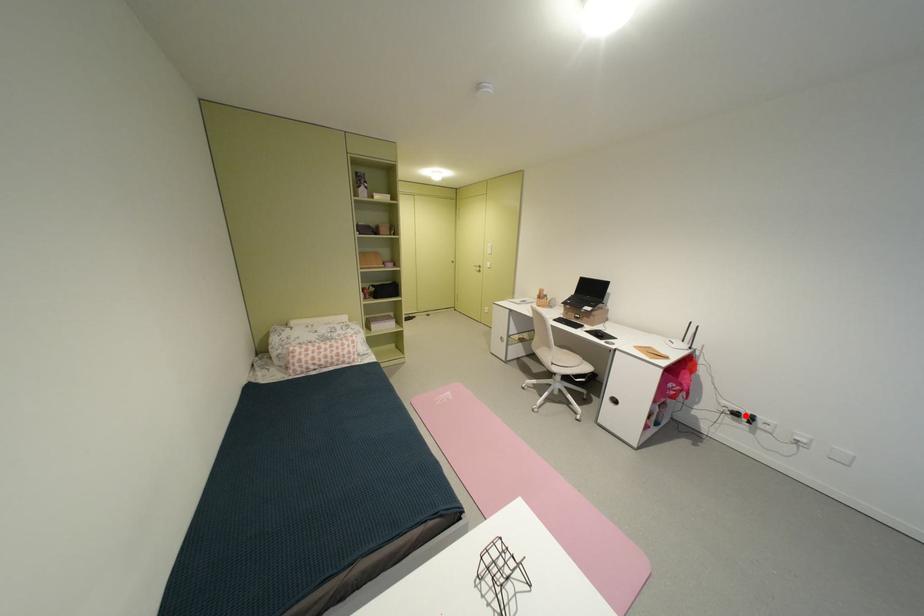
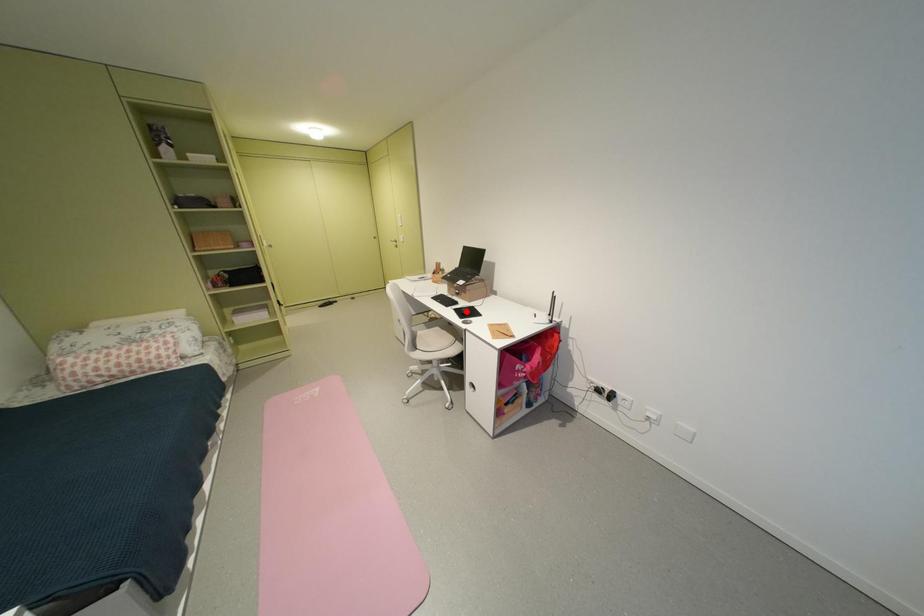
I am providing you with two images of the same scene from different viewpoints. A red point is marked on the first image and another point is marked on the second image. Are the points marked in image1 and image2 representing the same 3D position?

No